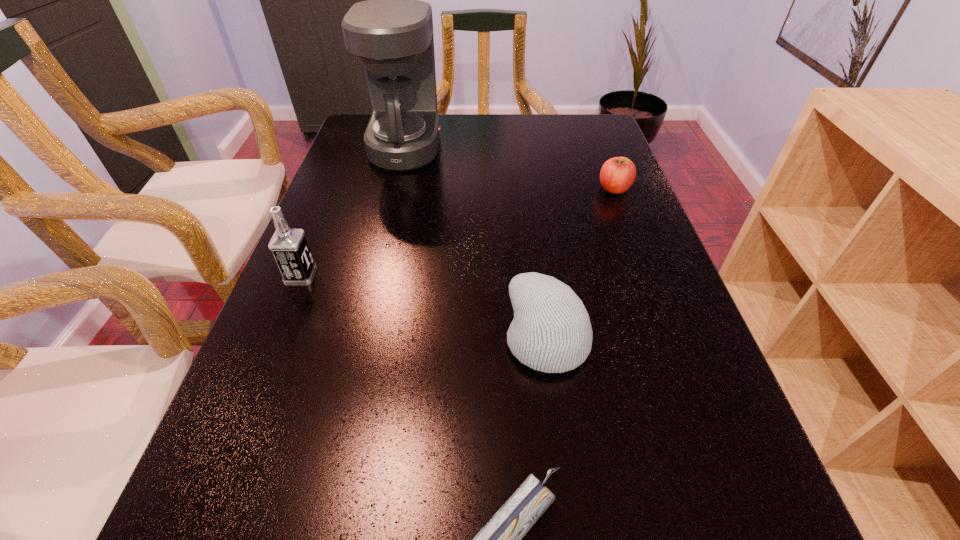
Image resolution: width=960 pixels, height=540 pixels. I want to click on empty space between the third nearest object and the apple, so point(458,232).

You are a GUI agent. You are given a task and a screenshot of the screen. Output one action in this format:
    pyautogui.click(x=<x>, y=<y>)
    Task: Click on the unoccupied position between the third tallest object and the second shortest object
    This screenshot has height=540, width=960.
    Given the screenshot: What is the action you would take?
    pyautogui.click(x=581, y=262)

What are the coordinates of `vacant region between the fourth nearest object and the vodka` in the screenshot? It's located at (458, 232).

Where is `unoccupied position between the tallest object and the rightmost object`? This screenshot has width=960, height=540. unoccupied position between the tallest object and the rightmost object is located at coordinates (510, 168).

Locate an element on the screen. The height and width of the screenshot is (540, 960). empty space between the second tallest object and the second farthest object is located at coordinates (458, 232).

The image size is (960, 540). I want to click on vacant region between the rightmost object and the second object from left to right, so click(510, 168).

Locate which object is the closest to the third nearest object. Please provide its 2D coordinates. Your answer should be formatted as a tuple, i.e. [(x, y)], where the tuple contains the x and y coordinates of a point satisfying the conditions above.

[(392, 32)]

Locate an element on the screen. the third closest object to the second farthest object is located at coordinates (289, 247).

Identify the location of vacant area that satisfies the following two spatial constraints: 1. on the button side of the fourth farthest object; 2. on the left side of the coffee maker. The height and width of the screenshot is (540, 960). (360, 335).

Locate an element on the screen. The image size is (960, 540). vacant position in the image that satisfies the following two spatial constraints: 1. on the button side of the fourth tallest object; 2. on the left side of the farthest object is located at coordinates [x=396, y=189].